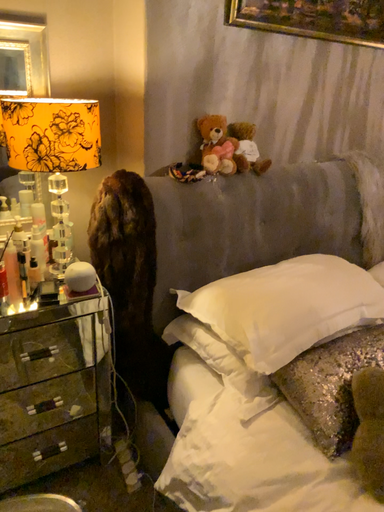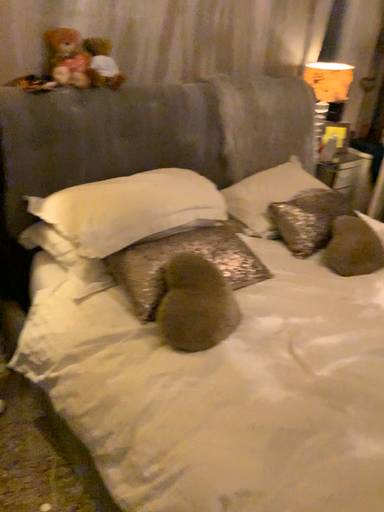
Question: How did the camera likely rotate when shooting the video?

Choices:
 (A) rotated upward
 (B) rotated downward

Answer: (B)